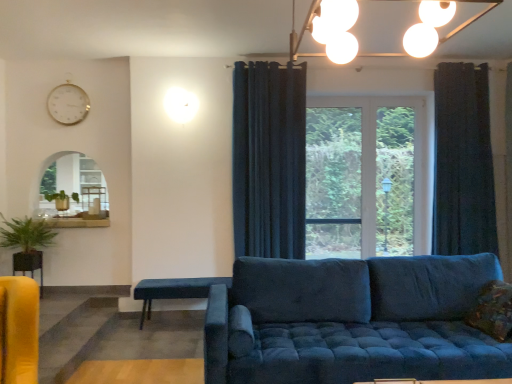
Question: Is green leafy plant at left located within matte white table at left, the 1th table when ordered from back to front?

Choices:
 (A) no
 (B) yes

Answer: (A)

Question: From the image's perspective, does matte white table at left, which is the second table from right to left, appear lower than green leafy plant at left?

Choices:
 (A) no
 (B) yes

Answer: (A)

Question: Considering the relative sizes of matte white table at left, which is counted as the second table, starting from the left, and green leafy plant at left in the image provided, is matte white table at left, which is counted as the second table, starting from the left, wider than green leafy plant at left?

Choices:
 (A) yes
 (B) no

Answer: (B)

Question: Does matte white table at left, the third table from the front, have a smaller size compared to green leafy plant at left?

Choices:
 (A) no
 (B) yes

Answer: (B)

Question: Is matte white table at left, which is counted as the second table, starting from the left, at the left side of green leafy plant at left?

Choices:
 (A) yes
 (B) no

Answer: (B)

Question: Is matte white table at left, which is the second table from right to left, looking in the opposite direction of green leafy plant at left?

Choices:
 (A) no
 (B) yes

Answer: (A)

Question: Is the depth of matte yellow table at lower left, the second table when ordered from front to back, less than that of dark blue textured curtain at right, which appears as the first curtain when viewed from the right?

Choices:
 (A) no
 (B) yes

Answer: (B)

Question: From the image's perspective, is matte yellow table at lower left, acting as the second table starting from the back, beneath dark blue textured curtain at right, which appears as the first curtain when viewed from the right?

Choices:
 (A) yes
 (B) no

Answer: (A)

Question: From the image's perspective, would you say matte yellow table at lower left, the 1th table viewed from the left, is positioned over dark blue textured curtain at right, which appears as the first curtain when viewed from the right?

Choices:
 (A) no
 (B) yes

Answer: (A)

Question: Is matte yellow table at lower left, which is the third table from right to left, thinner than dark blue textured curtain at right, which appears as the first curtain when viewed from the right?

Choices:
 (A) no
 (B) yes

Answer: (B)

Question: Can you confirm if matte yellow table at lower left, the 2th table viewed from the top, is bigger than dark blue textured curtain at right, which ranks as the 2th curtain in left-to-right order?

Choices:
 (A) yes
 (B) no

Answer: (B)

Question: Considering the relative sizes of matte yellow table at lower left, the second table when ordered from front to back, and dark blue textured curtain at right, which appears as the first curtain when viewed from the right, in the image provided, is matte yellow table at lower left, the second table when ordered from front to back, taller than dark blue textured curtain at right, which appears as the first curtain when viewed from the right,?

Choices:
 (A) yes
 (B) no

Answer: (B)

Question: Can you confirm if dark blue textured curtain at right, which appears as the first curtain when viewed from the right, is shorter than textured brown pillow at lower right?

Choices:
 (A) no
 (B) yes

Answer: (A)